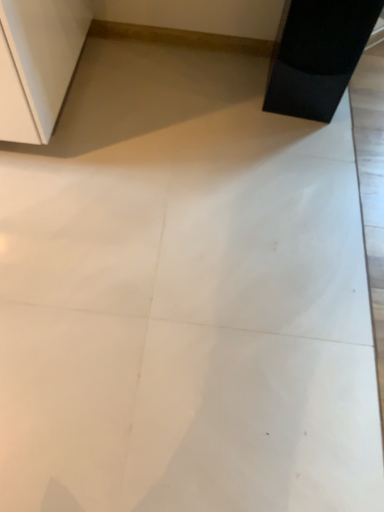
This screenshot has height=512, width=384. Identify the location of glossy black speaker at upper right. (317, 55).

Image resolution: width=384 pixels, height=512 pixels. What do you see at coordinates (317, 55) in the screenshot? I see `glossy black speaker at upper right` at bounding box center [317, 55].

What is the approximate height of glossy black speaker at upper right?

The height of glossy black speaker at upper right is 16.80 inches.

This screenshot has height=512, width=384. Identify the location of glossy black speaker at upper right. (317, 55).